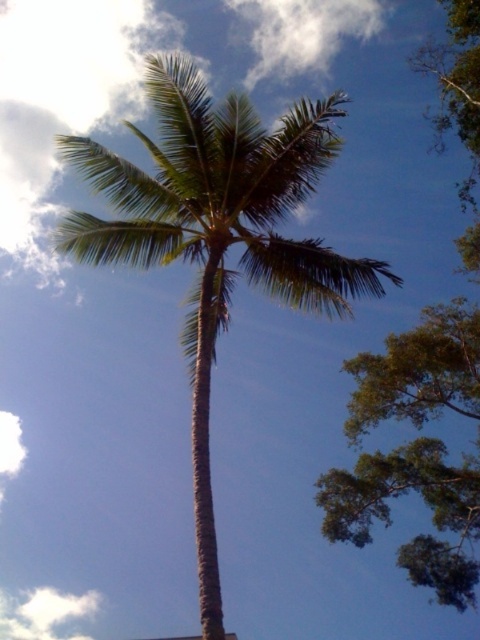
Question: Does green leafy coconut tree at center appear under green leafy palm at upper left?

Choices:
 (A) no
 (B) yes

Answer: (A)

Question: Which object appears closest to the camera in this image?

Choices:
 (A) green leafy palm at upper left
 (B) green leafy coconut tree at center

Answer: (B)

Question: Is green leafy coconut tree at center positioned behind green leafy palm at upper left?

Choices:
 (A) yes
 (B) no

Answer: (B)

Question: Is green leafy coconut tree at center smaller than green leafy palm at upper left?

Choices:
 (A) yes
 (B) no

Answer: (B)

Question: Which of the following is the farthest from the observer?

Choices:
 (A) green leafy palm at upper left
 (B) green leafy coconut tree at center

Answer: (A)